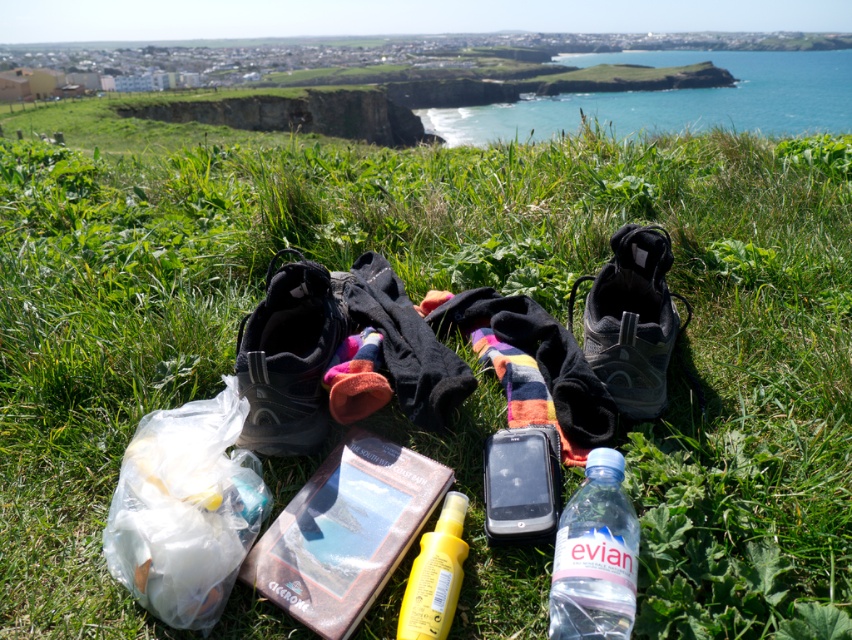
You are a hiker who wants to pack your belongings. You have a translucent plastic bag at center and blue water at upper center in your view. Which item is shorter in height?

The translucent plastic bag at center is shorter than the blue water at upper center.

You are standing at the point with coordinates point (567, 576) and want to walk towards the point with coordinates point (245, 109). Which direction should you move relative to your current position?

You should move towards the point (245, 109), which is further away from you since point (567, 576) is closer to the viewer than point (245, 109).

From the picture: You are a hiker who wants to pack your belongings. You have a translucent plastic bag at center and a green grassy cliff at center. Which item can you fold into a smaller size?

The translucent plastic bag at center can be folded into a smaller size because it is thinner than the green grassy cliff at center.